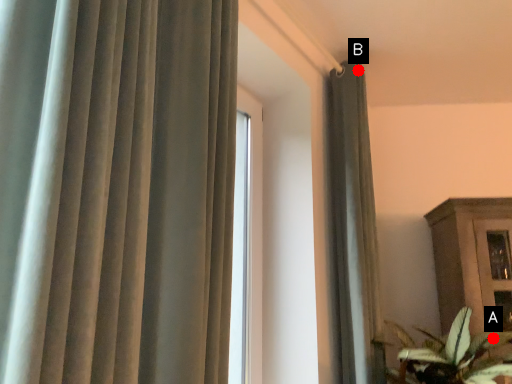
Question: Two points are circled on the image, labeled by A and B beside each circle. Which point is further to the camera?

Choices:
 (A) A is further
 (B) B is further

Answer: (B)